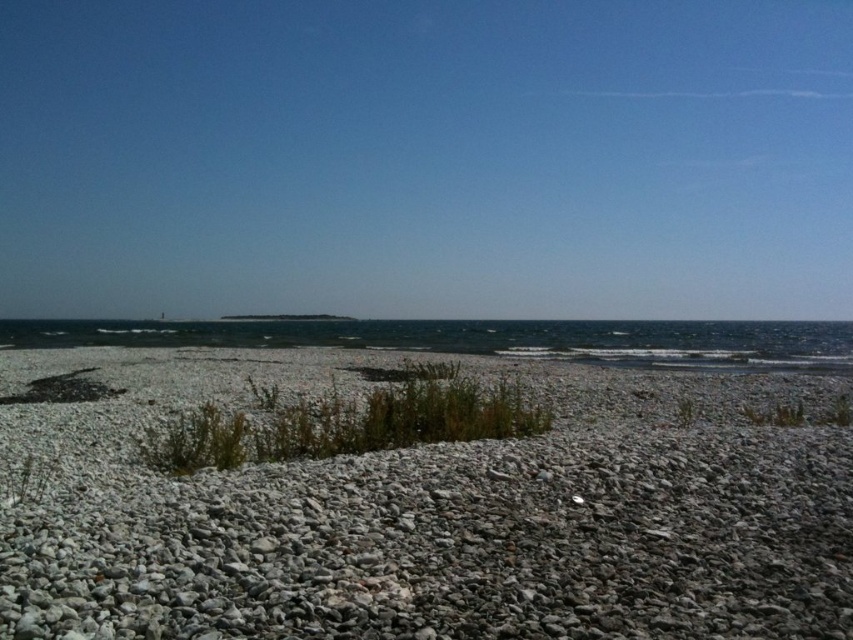
Question: Is gray gravel at center smaller than clear blue water at center?

Choices:
 (A) no
 (B) yes

Answer: (B)

Question: Is gray gravel at center above clear blue water at center?

Choices:
 (A) yes
 (B) no

Answer: (B)

Question: Which point is closer to the camera taking this photo?

Choices:
 (A) (805, 339)
 (B) (305, 497)

Answer: (B)

Question: Is gray gravel at center wider than clear blue water at center?

Choices:
 (A) no
 (B) yes

Answer: (A)

Question: Which point is closer to the camera taking this photo?

Choices:
 (A) (265, 330)
 (B) (689, 582)

Answer: (B)